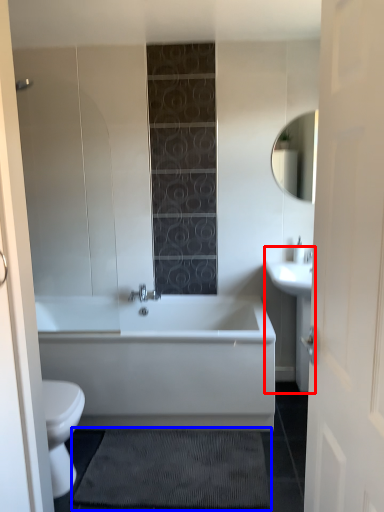
Question: Among these objects, which one is nearest to the camera, sink (highlighted by a red box) or bath mat (highlighted by a blue box)?

Choices:
 (A) sink
 (B) bath mat

Answer: (B)